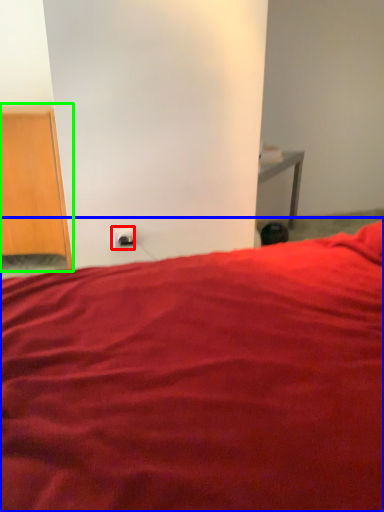
Question: Which is nearer to the electric outlet (highlighted by a red box)? bed (highlighted by a blue box) or furniture (highlighted by a green box).

Choices:
 (A) bed
 (B) furniture

Answer: (B)